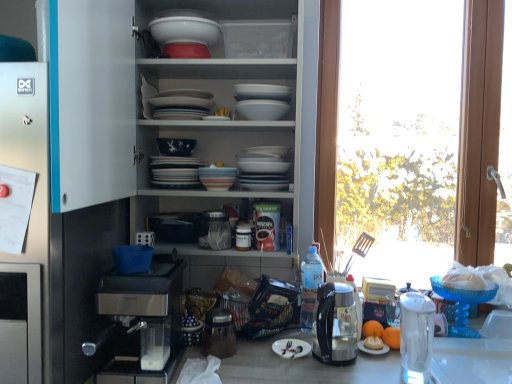
Locate an element on the screen. The image size is (512, 384). empty space that is ontop of white glossy bowl at upper center, which is counted as the first appliance, starting from the top (from a real-world perspective) is located at coordinates (185, 21).